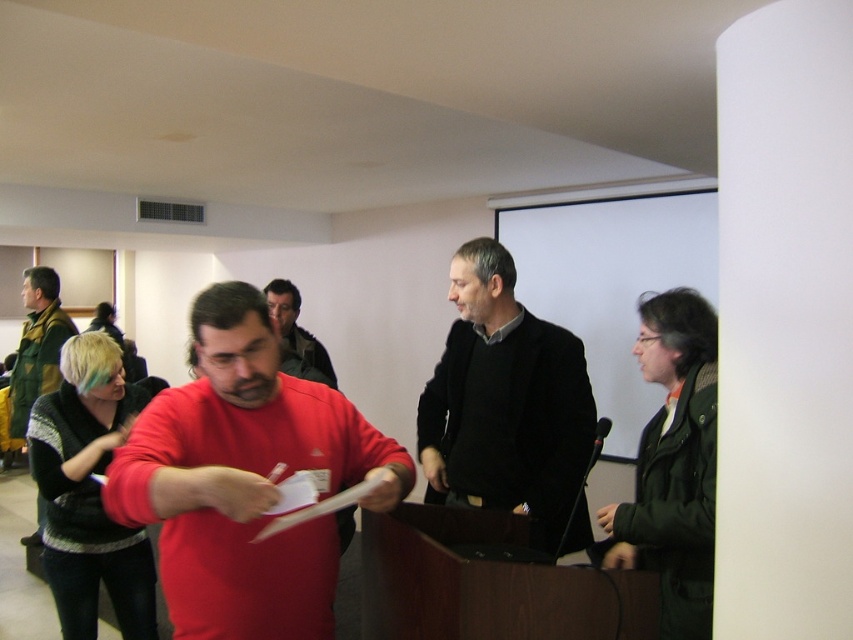
You are organizing a photo shoot and need to arrange two jackets in a display case. The display case has a width limit of 40 cm. You have the dark green jacket at right and the matte black jacket at center. Based on their sizes, which jacket can fit in the display case if the other cannot?

The dark green jacket at right has a lesser width compared to the matte black jacket at center. Therefore, the dark green jacket at right can fit in the display case if the matte black jacket at center cannot due to its wider size.

You are an event organizer who needs to ensure all speakers are visible to the audience. You notice the matte red shirt at center and the black matte sweater at center. Which speaker should adjust their position to avoid being obscured?

The matte red shirt at center should adjust their position because it is positioned under the black matte sweater at center, meaning it might be blocked from the audience view.

You are a photographer setting up for a group photo in the conference room. You need to position two subjects wearing the black matte sweater at center and the green textured jacket at left. What is the minimum distance you should maintain between them to ensure they are both in frame?

The minimum distance you should maintain between the black matte sweater at center and the green textured jacket at left is 2.68 meters to ensure they are both in frame.